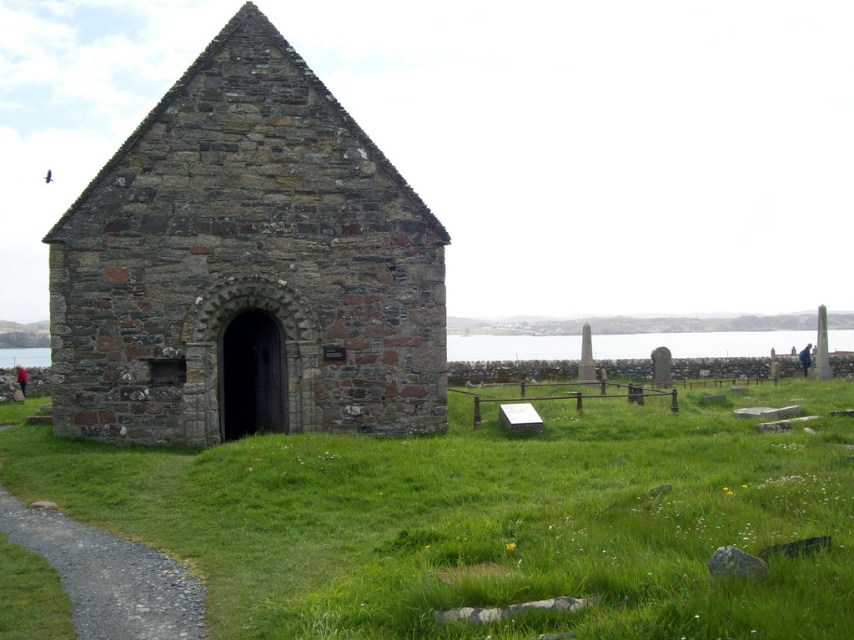
You are standing in the grassy area around the chapel and see two points marked on the ground. The first point is at coordinate point (385, 588) and the second is at point (173, 611). If you want to walk towards the chapel entrance, which point should you start from to be closer to the entrance?

Point (385, 588) is in front of point (173, 611), so starting from point (385, 588) would place you closer to the chapel entrance.

In the scene shown: You are a visitor approaching the chapel and want to reach the entrance. You are currently standing on the gravel path at lower left. Which direction should you move to step onto the green grassy at center and head towards the chapel entrance?

To reach the chapel entrance, you should move forward from the gravel path at lower left towards the green grassy at center, as the green grassy at center is in front of the gravel path at lower left.

You are standing at the end of the gravel path at lower left and want to enter the rustic stone church at center. Which direction should you walk to reach the church?

The rustic stone church at center is located above the gravel path at lower left, so you should walk upwards or towards the higher elevation to reach the church.